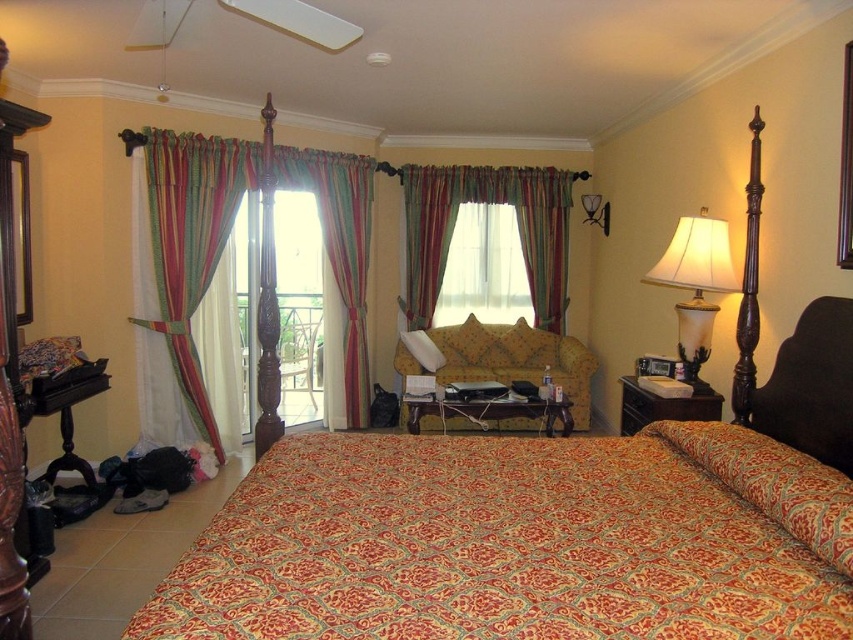
Question: Considering the relative positions of white fabric pillow at center and white glossy lampshade at upper right in the image provided, where is white fabric pillow at center located with respect to white glossy lampshade at upper right?

Choices:
 (A) right
 (B) left

Answer: (B)

Question: Can you confirm if yellow floral fabric sofa at center is positioned below matte wood dresser at right?

Choices:
 (A) yes
 (B) no

Answer: (B)

Question: Which point is farther to the camera?

Choices:
 (A) striped fabric curtain at center
 (B) sheer fabric curtain at center

Answer: (B)

Question: Which point is closer to the camera?

Choices:
 (A) translucent glass lampshade at right
 (B) striped fabric curtain at center
 (C) white glossy lampshade at upper right

Answer: (A)

Question: Does matte wood dresser at right have a larger size compared to white fabric pillow at center?

Choices:
 (A) no
 (B) yes

Answer: (B)

Question: Which point is farther to the camera?

Choices:
 (A) transparent glass door at center
 (B) white glossy lampshade at upper right
 (C) yellow floral fabric sofa at center

Answer: (B)